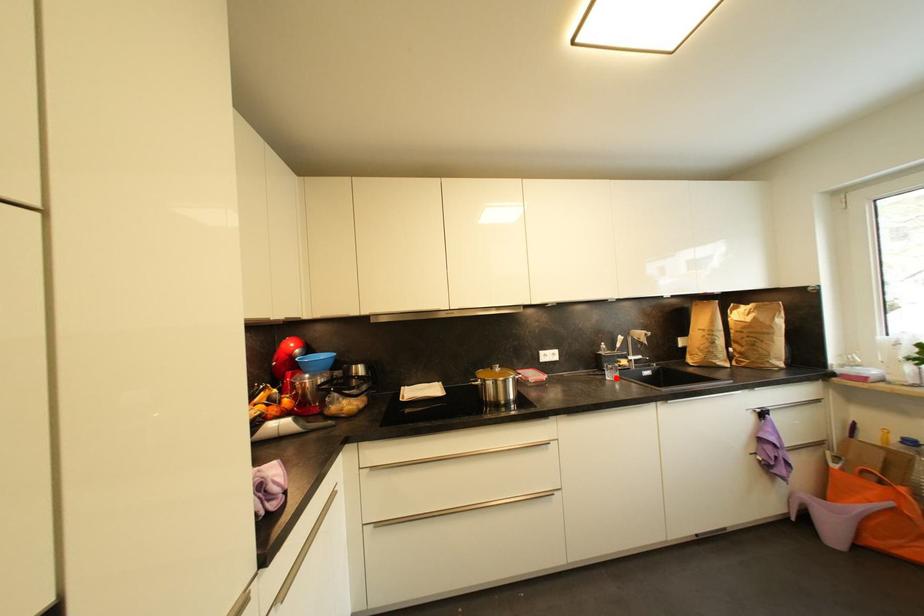
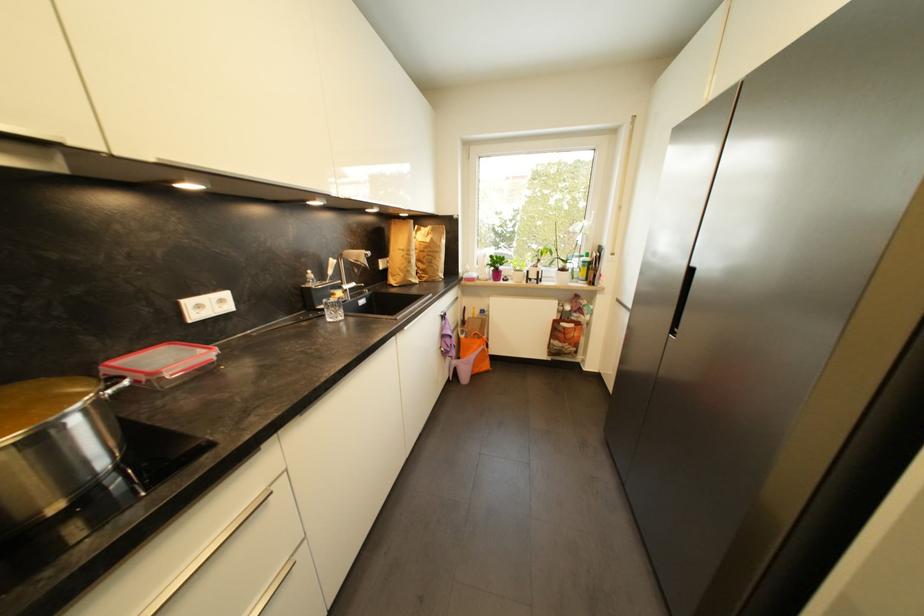
Find the pixel in the second image that matches the highlighted location in the first image.

(339, 317)